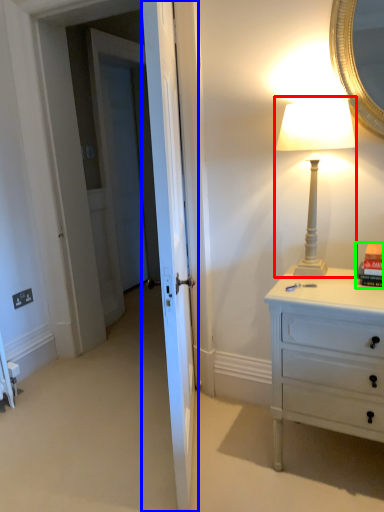
Question: Considering the real-world distances, which object is farthest from bedside lamp (highlighted by a red box)? door (highlighted by a blue box) or book (highlighted by a green box)?

Choices:
 (A) door
 (B) book

Answer: (A)